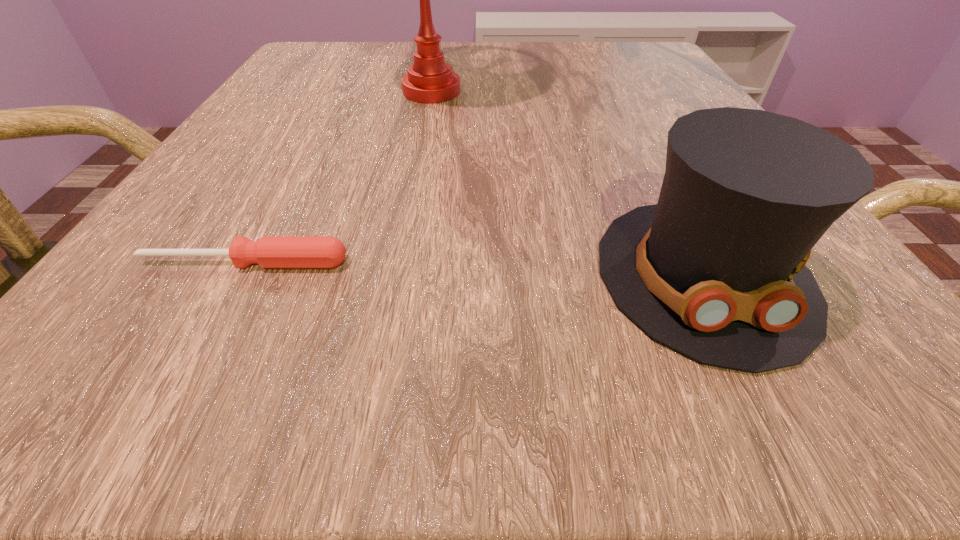
At what (x,y) coordinates should I click in order to perform the action: click on the farthest object. Please return your answer as a coordinate pair (x, y). Image resolution: width=960 pixels, height=540 pixels. Looking at the image, I should click on (429, 80).

Identify the location of table lamp. (429, 80).

At what (x,y) coordinates should I click in order to perform the action: click on the second shortest object. Please return your answer as a coordinate pair (x, y). Looking at the image, I should click on (715, 270).

This screenshot has width=960, height=540. I want to click on dress hat, so click(715, 270).

Identify the location of screwdriver. The width and height of the screenshot is (960, 540). (269, 251).

You are a GUI agent. You are given a task and a screenshot of the screen. Output one action in this format:
    pyautogui.click(x=<x>, y=<y>)
    Task: Click on the vacant space located 0.280m on the front-facing side of the table lamp
    The width and height of the screenshot is (960, 540).
    Given the screenshot: What is the action you would take?
    (x=660, y=92)

Locate an element on the screen. This screenshot has width=960, height=540. vacant space situated 0.090m on the front of the shortest object is located at coordinates (202, 342).

Identify the location of object present at the far edge. This screenshot has height=540, width=960. (429, 80).

At what (x,y) coordinates should I click in order to perform the action: click on object that is at the near edge. Please return your answer as a coordinate pair (x, y). Looking at the image, I should click on (715, 270).

Where is `table lamp present at the left edge`? This screenshot has width=960, height=540. table lamp present at the left edge is located at coordinates (429, 80).